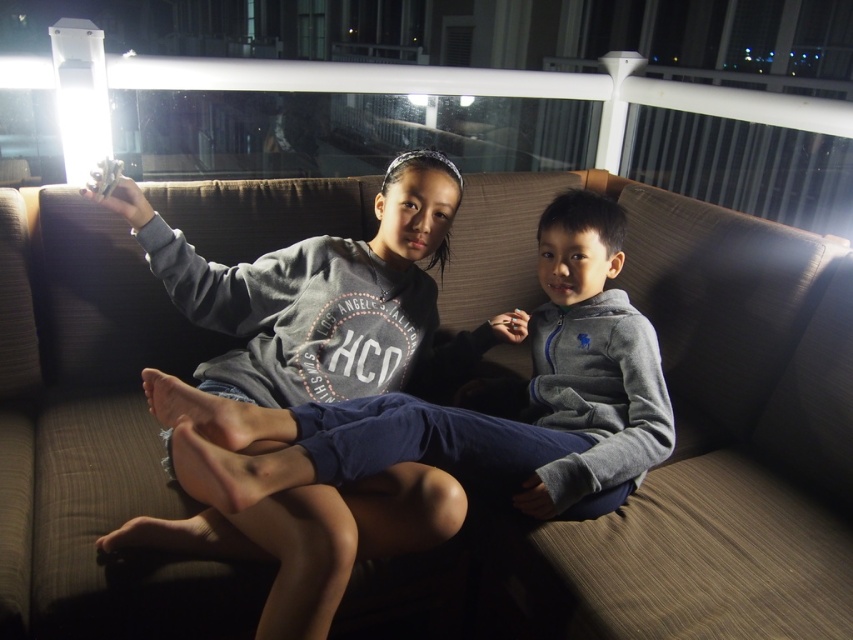
You are trying to decide if the gray fleece sweatshirt at center can be placed on the brown fabric couch at center. Based on their sizes, would it fit?

The brown fabric couch at center might be wider than gray fleece sweatshirt at center, so the sweatshirt could fit on the couch since the couch is wider.

You are a photographer trying to capture a photo of the brown fabric couch at center and the gray fleece sweatshirt at center. Based on their positions, which object should you focus on first to ensure both are in frame?

The gray fleece sweatshirt at center should be focused on first since it is below the brown fabric couch at center, allowing the photographer to adjust the framing to include both objects.

From the picture: You are a photographer trying to capture a photo of the two children on the brown fabric couch at center and the gray fleece sweatshirt at center. Based on their positions, which object is located to the left of the other?

The brown fabric couch at center is positioned on the left side of gray fleece sweatshirt at center, so the couch is to the left of the sweatshirt.